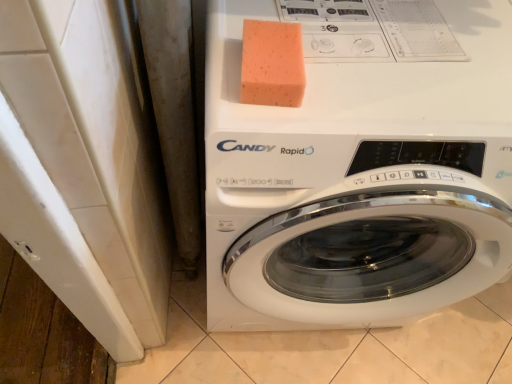
This screenshot has height=384, width=512. I want to click on white glossy washing machine at center, so click(x=359, y=168).

What do you see at coordinates (359, 168) in the screenshot? This screenshot has width=512, height=384. I see `white glossy washing machine at center` at bounding box center [359, 168].

What do you see at coordinates (272, 64) in the screenshot? I see `orange sponge at upper center` at bounding box center [272, 64].

Where is `orange sponge at upper center`? orange sponge at upper center is located at coordinates (272, 64).

Measure the distance between orange sponge at upper center and camera.

orange sponge at upper center is 21.50 inches away from camera.

Where is `white glossy washing machine at center`? white glossy washing machine at center is located at coordinates (359, 168).

Is orange sponge at upper center at the right side of white glossy washing machine at center?

No.

Is orange sponge at upper center positioned before white glossy washing machine at center?

No, orange sponge at upper center is behind white glossy washing machine at center.

Is point (273, 42) closer or farther from the camera than point (506, 276)?

Clearly, point (273, 42) is closer to the camera than point (506, 276).

From the image's perspective, is orange sponge at upper center located beneath white glossy washing machine at center?

Incorrect, from the image's perspective, orange sponge at upper center is higher than white glossy washing machine at center.

From a real-world perspective, who is located lower, orange sponge at upper center or white glossy washing machine at center?

In real-world perspective, white glossy washing machine at center is lower.

Which object is thinner, orange sponge at upper center or white glossy washing machine at center?

Thinner between the two is orange sponge at upper center.

Is orange sponge at upper center taller or shorter than white glossy washing machine at center?

In the image, orange sponge at upper center appears to be shorter than white glossy washing machine at center.

Is orange sponge at upper center bigger than white glossy washing machine at center?

No.

Is orange sponge at upper center situated inside white glossy washing machine at center or outside?

orange sponge at upper center is inside white glossy washing machine at center.

Are orange sponge at upper center and white glossy washing machine at center far apart?

No.

Is orange sponge at upper center looking in the opposite direction of white glossy washing machine at center?

orange sponge at upper center is not turned away from white glossy washing machine at center.

Consider the image. How many degrees apart are the facing directions of orange sponge at upper center and white glossy washing machine at center?

The facing directions of orange sponge at upper center and white glossy washing machine at center are 4.3 degrees apart.

Measure the distance from orange sponge at upper center to white glossy washing machine at center.

They are 11.45 inches apart.

At what (x,y) coordinates should I click in order to perform the action: click on washing machine that appears in front of the orange sponge at upper center. Please return your answer as a coordinate pair (x, y). The width and height of the screenshot is (512, 384). Looking at the image, I should click on (359, 168).

Which is more to the right, white glossy washing machine at center or orange sponge at upper center?

white glossy washing machine at center.

Between white glossy washing machine at center and orange sponge at upper center, which one is positioned in front?

white glossy washing machine at center.

Between point (223, 5) and point (282, 55), which one is positioned behind?

Point (223, 5)

From the image's perspective, is white glossy washing machine at center over orange sponge at upper center?

No, from the image's perspective, white glossy washing machine at center is not on top of orange sponge at upper center.

From a real-world perspective, is white glossy washing machine at center below orange sponge at upper center?

Yes, from a real-world perspective, white glossy washing machine at center is below orange sponge at upper center.

Considering the sizes of white glossy washing machine at center and orange sponge at upper center in the image, is white glossy washing machine at center wider or thinner than orange sponge at upper center?

Clearly, white glossy washing machine at center has more width compared to orange sponge at upper center.

In terms of height, does white glossy washing machine at center look taller or shorter compared to orange sponge at upper center?

In the image, white glossy washing machine at center appears to be taller than orange sponge at upper center.

Which of these two, white glossy washing machine at center or orange sponge at upper center, is bigger?

white glossy washing machine at center is bigger.

Would you say white glossy washing machine at center is outside orange sponge at upper center?

Yes, white glossy washing machine at center is located beyond the bounds of orange sponge at upper center.

Is white glossy washing machine at center not close to orange sponge at upper center?

white glossy washing machine at center is actually quite close to orange sponge at upper center.

Could you tell me if white glossy washing machine at center is turned towards orange sponge at upper center?

No, white glossy washing machine at center does not turn towards orange sponge at upper center.

How many degrees apart are the facing directions of white glossy washing machine at center and orange sponge at upper center?

white glossy washing machine at center and orange sponge at upper center are facing 4.3 degrees away from each other.

You are a GUI agent. You are given a task and a screenshot of the screen. Output one action in this format:
    pyautogui.click(x=<x>, y=<y>)
    Task: Click on the soap above the white glossy washing machine at center (from a real-world perspective)
    This screenshot has width=512, height=384.
    Given the screenshot: What is the action you would take?
    pyautogui.click(x=272, y=64)

Locate an element on the screen. The height and width of the screenshot is (384, 512). washing machine located underneath the orange sponge at upper center (from a real-world perspective) is located at coordinates (359, 168).

The height and width of the screenshot is (384, 512). Find the location of `washing machine on the right of orange sponge at upper center`. washing machine on the right of orange sponge at upper center is located at coordinates (359, 168).